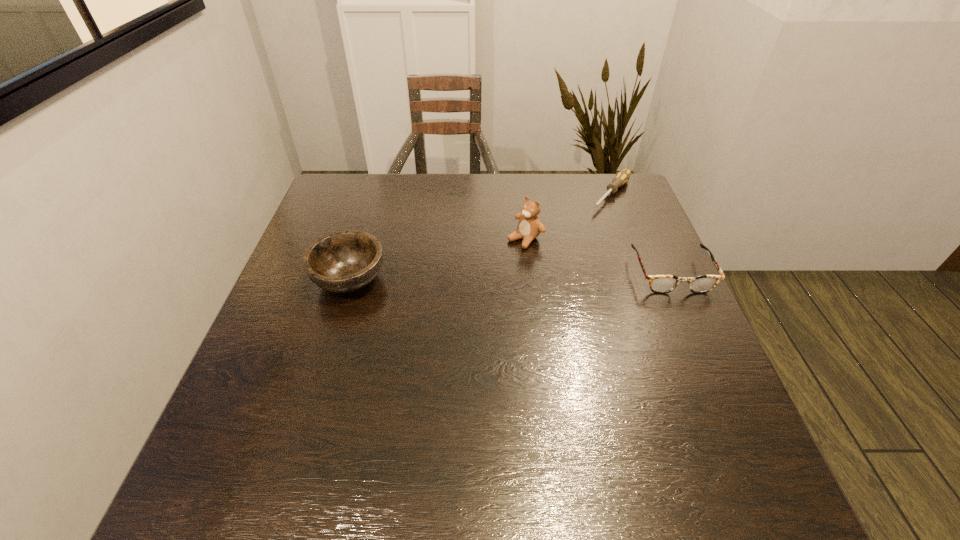
At what (x,y) coordinates should I click in order to perform the action: click on vacant space at the far edge of the desktop. Please return your answer as a coordinate pair (x, y). The width and height of the screenshot is (960, 540). Looking at the image, I should click on (440, 186).

In the image, there is a desktop. At what (x,y) coordinates should I click in order to perform the action: click on vacant space at the near edge. Please return your answer as a coordinate pair (x, y). The width and height of the screenshot is (960, 540). Looking at the image, I should click on point(638,420).

The height and width of the screenshot is (540, 960). In the image, there is a desktop. What are the coordinates of `vacant space at the left edge` in the screenshot? It's located at (288, 298).

Locate an element on the screen. vacant space at the right edge is located at coordinates pos(666,313).

Where is `free space at the far left corner`? The height and width of the screenshot is (540, 960). free space at the far left corner is located at coordinates (379, 185).

Identify the location of free space at the near left corner. (305, 426).

The width and height of the screenshot is (960, 540). In order to click on free space at the far right corner of the desktop in this screenshot , I will do `click(599, 192)`.

The image size is (960, 540). What are the coordinates of `free spot between the bowl and the screwdriver` in the screenshot? It's located at (481, 237).

Where is `free space that is in between the teddy bear and the third tallest object`? This screenshot has width=960, height=540. free space that is in between the teddy bear and the third tallest object is located at coordinates (598, 256).

At what (x,y) coordinates should I click in order to perform the action: click on free point between the third shortest object and the shortest object. Please return your answer as a coordinate pair (x, y). Looking at the image, I should click on (481, 237).